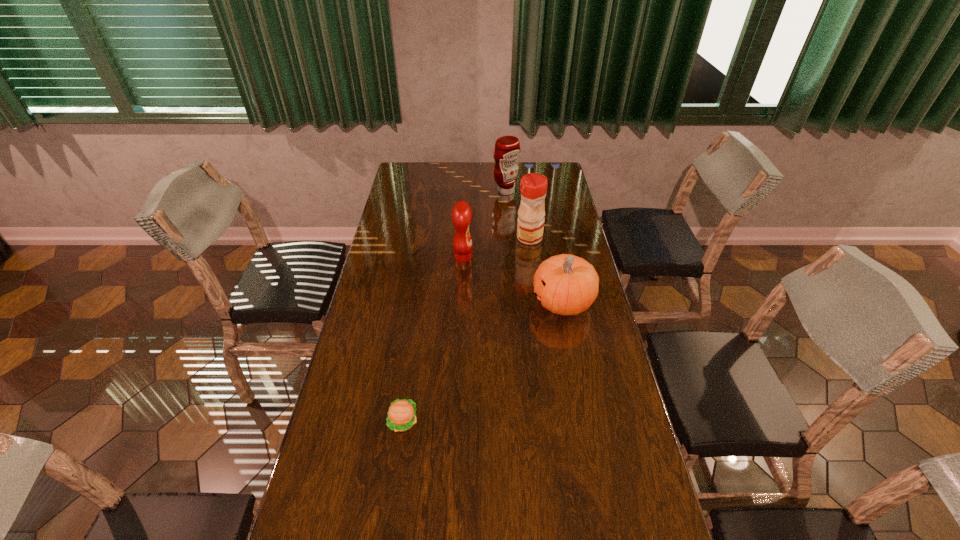
Locate an element on the screen. The width and height of the screenshot is (960, 540). object that is the second closest one to the second farthest object is located at coordinates (565, 284).

Locate which condiment is the second closest to the second farthest condiment. Please provide its 2D coordinates. Your answer should be formatted as a tuple, i.e. [(x, y)], where the tuple contains the x and y coordinates of a point satisfying the conditions above.

[(507, 148)]

Select which condiment is the closest to the pumpkin. Please provide its 2D coordinates. Your answer should be formatted as a tuple, i.e. [(x, y)], where the tuple contains the x and y coordinates of a point satisfying the conditions above.

[(533, 187)]

Find the location of a particular element. vacant space that satisfies the following two spatial constraints: 1. on the front side of the second farthest object; 2. on the label side of the nearest condiment is located at coordinates (532, 258).